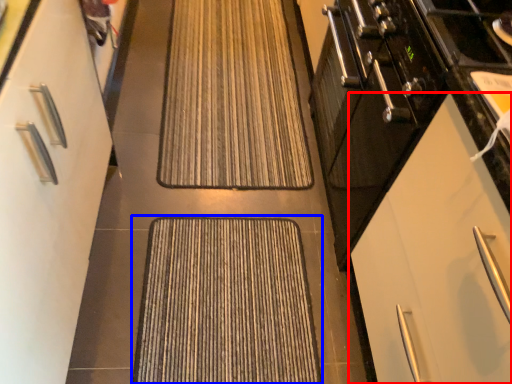
Question: Among these objects, which one is farthest to the camera, cabinetry (highlighted by a red box) or doormat (highlighted by a blue box)?

Choices:
 (A) cabinetry
 (B) doormat

Answer: (B)